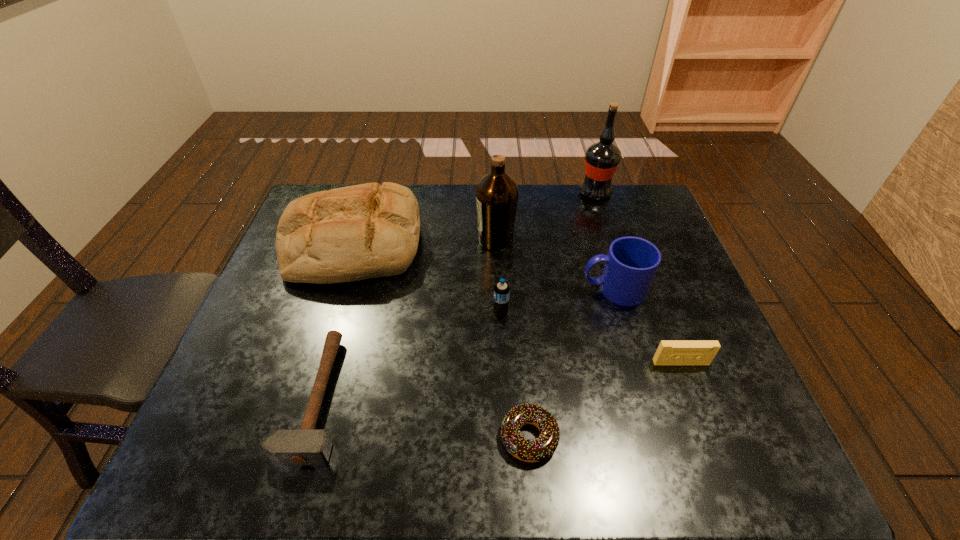
You are a GUI agent. You are given a task and a screenshot of the screen. Output one action in this format:
    pyautogui.click(x=<x>, y=<y>)
    Task: Click on the free spot located on the label of the olive oil
    
    Given the screenshot: What is the action you would take?
    (x=404, y=240)

Where is `vacant space located 0.070m on the label of the olive oil`? The width and height of the screenshot is (960, 540). vacant space located 0.070m on the label of the olive oil is located at coordinates (453, 240).

The width and height of the screenshot is (960, 540). Find the location of `blank space located on the front of the bread`. blank space located on the front of the bread is located at coordinates (321, 352).

Where is `vacant space located 0.350m on the side with the handle of the mug`? The height and width of the screenshot is (540, 960). vacant space located 0.350m on the side with the handle of the mug is located at coordinates (452, 289).

The width and height of the screenshot is (960, 540). Find the location of `vacant space located on the side with the handle of the mug`. vacant space located on the side with the handle of the mug is located at coordinates pyautogui.click(x=544, y=289).

Find the location of a particular element. The image size is (960, 540). vacant space located on the side with the handle of the mug is located at coordinates (448, 289).

Where is `free region located on the back of the soda bottle`? free region located on the back of the soda bottle is located at coordinates (498, 252).

I want to click on blank space located 0.180m at the front of the sixth tallest object with spools, so click(x=711, y=442).

Find the location of `blank space located on the striking surface of the second shortest object`. blank space located on the striking surface of the second shortest object is located at coordinates (399, 397).

Find the location of a particular element. vacant area located 0.060m on the right of the shortest object is located at coordinates (588, 437).